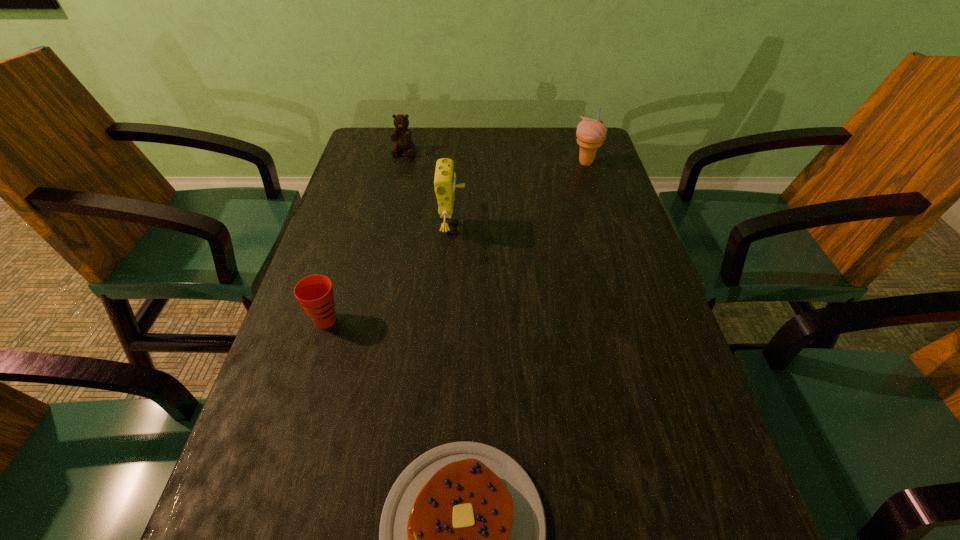
Identify the location of teddy bear located in the far edge section of the desktop. (401, 136).

Find the location of a particular element. teddy bear situated at the left edge is located at coordinates (401, 136).

The image size is (960, 540). In order to click on cup that is at the left edge in this screenshot , I will do `click(314, 293)`.

Find the location of a particular element. object that is at the right edge is located at coordinates (590, 133).

I want to click on object that is at the far left corner, so click(401, 136).

This screenshot has width=960, height=540. In order to click on object at the far right corner in this screenshot , I will do `click(590, 133)`.

The image size is (960, 540). In the image, there is a desktop. Find the location of `free space at the far edge`. free space at the far edge is located at coordinates (421, 155).

Image resolution: width=960 pixels, height=540 pixels. Find the location of `free space at the left edge of the desktop`. free space at the left edge of the desktop is located at coordinates (349, 351).

This screenshot has width=960, height=540. In the image, there is a desktop. What are the coordinates of `free space at the right edge` in the screenshot? It's located at (655, 477).

This screenshot has height=540, width=960. In the image, there is a desktop. Identify the location of vacant region at the far left corner. (373, 155).